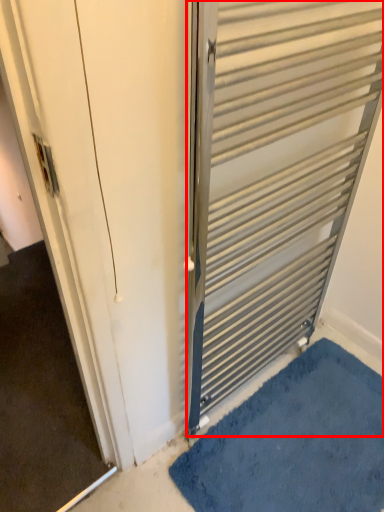
Question: From the image's perspective, where is door (annotated by the red box) located in relation to bath mat in the image?

Choices:
 (A) above
 (B) below

Answer: (A)